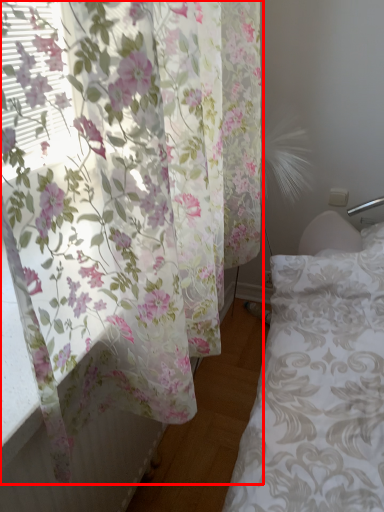
Question: From the image's perspective, what is the correct spatial relationship of curtain (annotated by the red box) in relation to bed frame?

Choices:
 (A) below
 (B) above

Answer: (B)